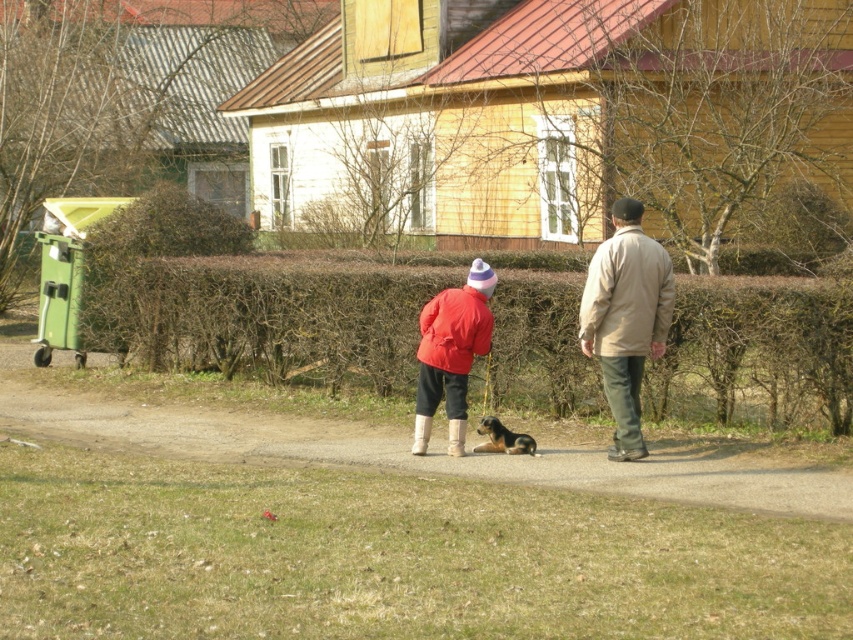
Identify the location of beige fabric jacket at center. The image size is (853, 640). 625,317.

The width and height of the screenshot is (853, 640). I want to click on beige fabric jacket at center, so click(x=625, y=317).

You are a GUI agent. You are given a task and a screenshot of the screen. Output one action in this format:
    pyautogui.click(x=<x>, y=<y>)
    Task: Click on the beige fabric jacket at center
    Image resolution: width=853 pixels, height=640 pixels.
    Given the screenshot: What is the action you would take?
    pyautogui.click(x=625, y=317)

Is dirt path at center above beige fabric jacket at center?

Actually, dirt path at center is below beige fabric jacket at center.

Is dirt path at center wider than beige fabric jacket at center?

Yes.

At what (x,y) coordinates should I click in order to perform the action: click on dirt path at center. Please return your answer as a coordinate pair (x, y). This screenshot has width=853, height=640. Looking at the image, I should click on (421, 458).

Between dirt path at center and matte red jacket at center, which one appears on the left side from the viewer's perspective?

matte red jacket at center

Who is shorter, dirt path at center or matte red jacket at center?

dirt path at center

I want to click on dirt path at center, so click(x=421, y=458).